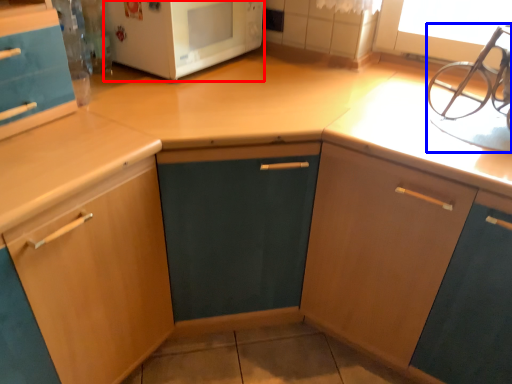
Question: Which of the following is the farthest to the observer, microwave oven (highlighted by a red box) or sink (highlighted by a blue box)?

Choices:
 (A) microwave oven
 (B) sink

Answer: (A)